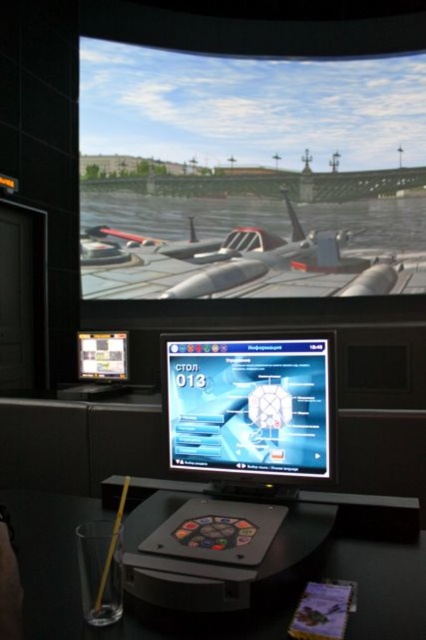
You are a flight instructor preparing a lesson on cockpit displays. You need to compare the sizes of the shiny silver aircraft at center and the shiny silver monitor at center in the setup. Which one has a greater width?

The shiny silver aircraft at center has a greater width than the shiny silver monitor at center.

You are a flight instructor preparing a lesson on cockpit visibility. You need to compare the height of the shiny silver aircraft at center and the shiny silver monitor at center. Which object is taller?

The shiny silver aircraft at center is taller than the shiny silver monitor at center according to the description.

You are a trainee pilot preparing for a simulation. You need to adjust your seat so that you can comfortably view both the cockpit monitor and the main screen. The cockpit monitor is on the black plastic table at lower center. How far apart are the cockpit monitor and the camera that records your actions?

The black plastic table at lower center and the camera are 32.56 inches apart from each other, so the cockpit monitor and the camera are 32.56 inches apart.